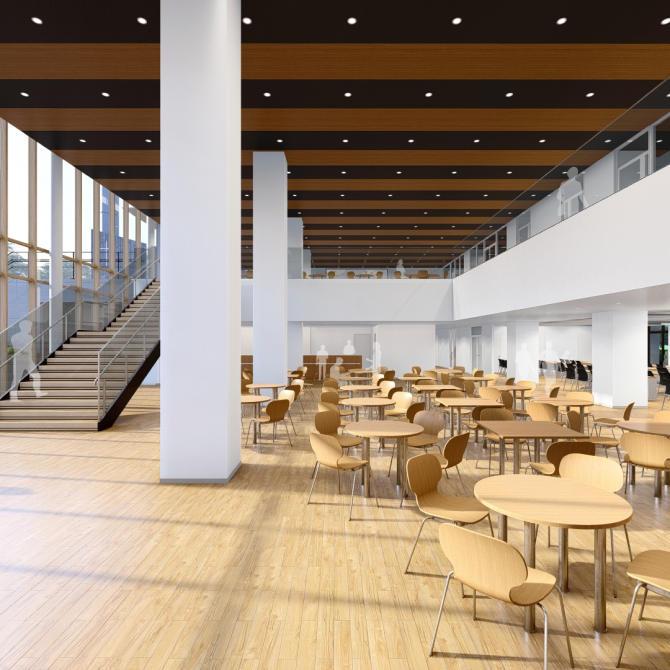
I want to click on support beams, so click(x=604, y=371), click(x=508, y=354), click(x=295, y=340), click(x=275, y=358), click(x=214, y=383).